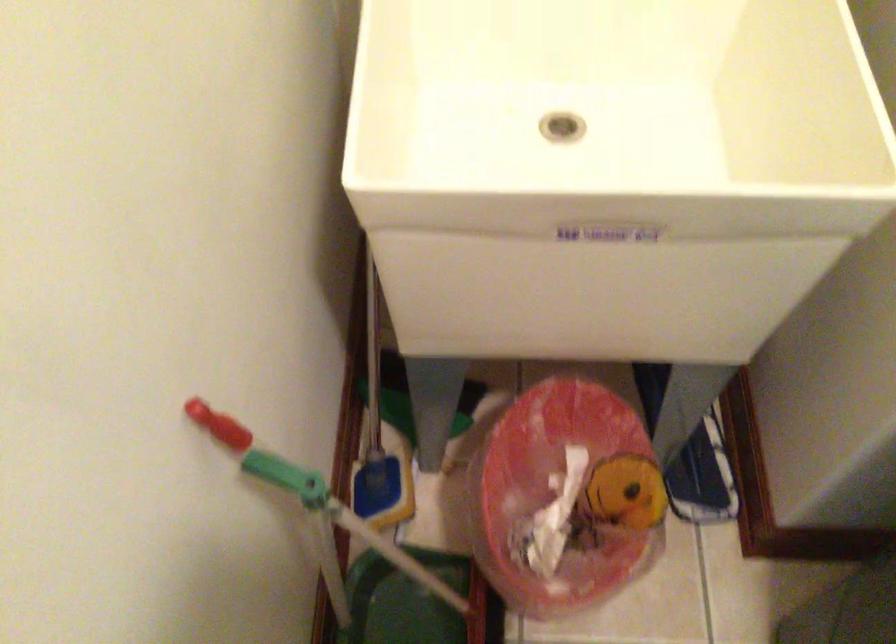
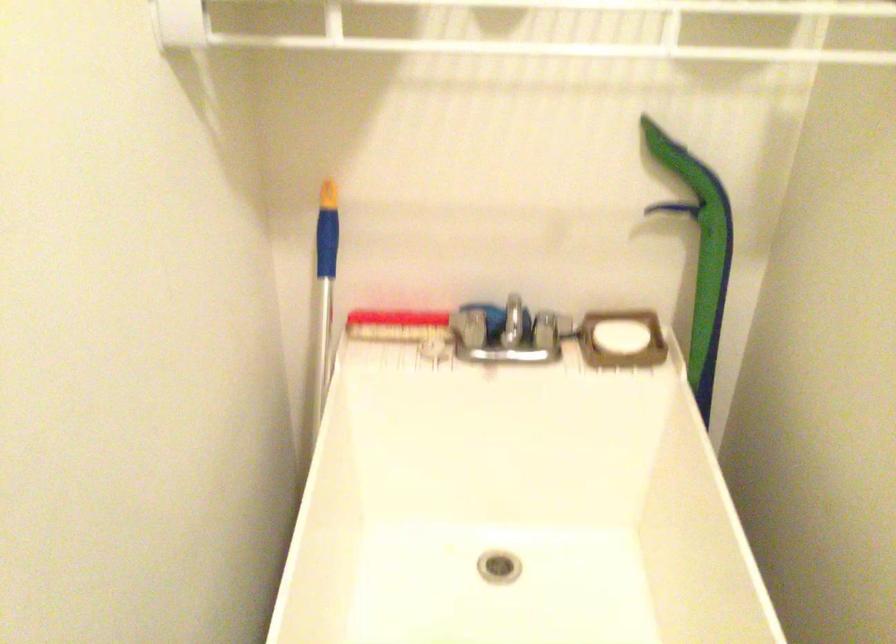
Which direction would the cameraman need to move to produce the second image?

The movement direction of the cameraman is right, backward.